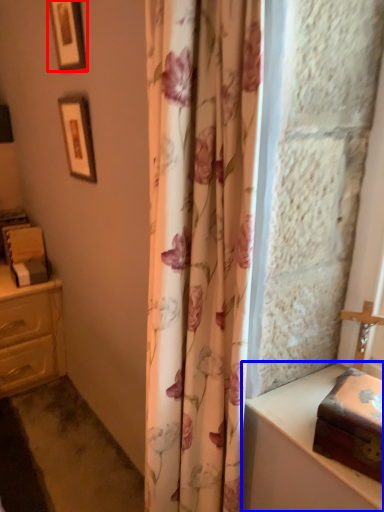
Question: Which object is further to the camera taking this photo, picture frame (highlighted by a red box) or vanity (highlighted by a blue box)?

Choices:
 (A) picture frame
 (B) vanity

Answer: (A)